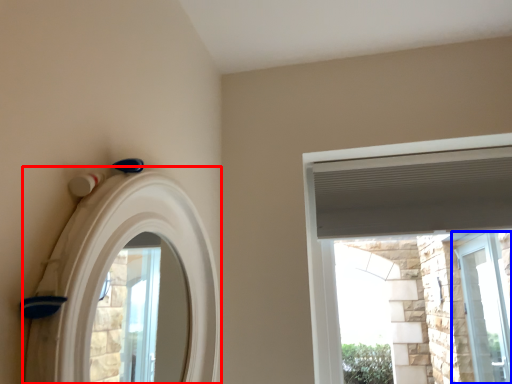
Question: Which object is closer to the camera taking this photo, archway (highlighted by a red box) or window (highlighted by a blue box)?

Choices:
 (A) archway
 (B) window

Answer: (A)